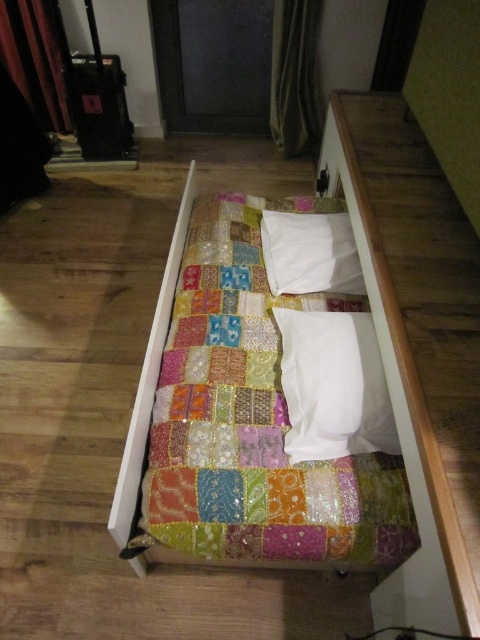
Question: Does patchwork fabric bed at center have a greater width compared to white soft pillow at center?

Choices:
 (A) no
 (B) yes

Answer: (B)

Question: Which point appears farthest from the camera in this image?

Choices:
 (A) (379, 557)
 (B) (303, 451)

Answer: (B)

Question: Is patchwork fabric bed at center bigger than white soft pillow at upper center?

Choices:
 (A) no
 (B) yes

Answer: (B)

Question: Observing the image, what is the correct spatial positioning of patchwork fabric bed at center in reference to white soft pillow at center?

Choices:
 (A) right
 (B) left

Answer: (B)

Question: Which point appears farthest from the camera in this image?

Choices:
 (A) (177, 321)
 (B) (337, 349)
 (C) (316, 276)

Answer: (C)

Question: Which point is farther from the camera taking this photo?

Choices:
 (A) (267, 321)
 (B) (358, 269)
 (C) (290, 442)

Answer: (B)